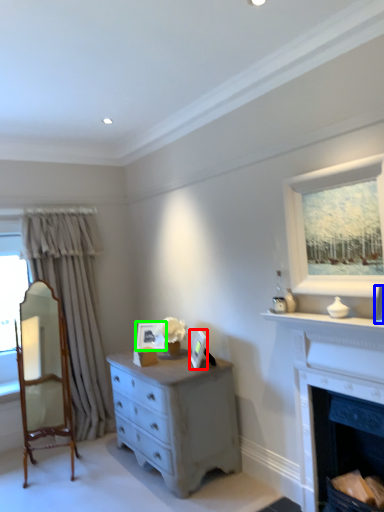
Question: Which object is positioned farthest from picture frame (highlighted by a red box)? Select from picture frame (highlighted by a blue box) and picture frame (highlighted by a green box).

Choices:
 (A) picture frame
 (B) picture frame

Answer: (A)